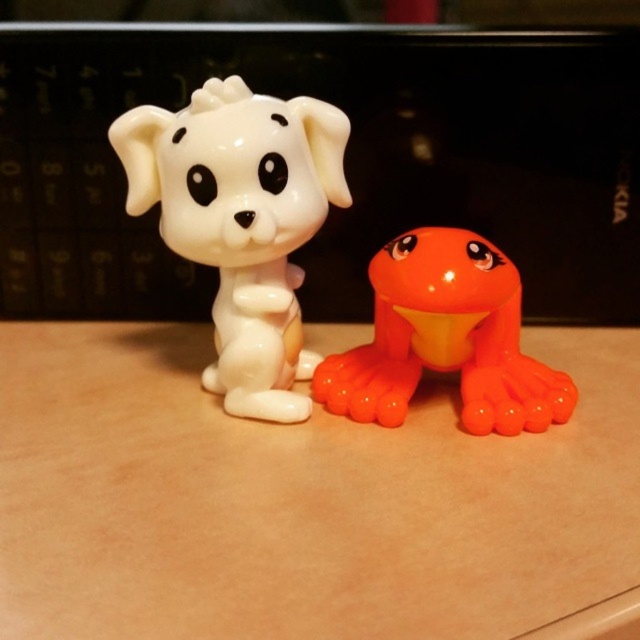
You are a small toy collector standing in front of the wooden surface. You want to pick up the closest figurine to you. Which one should you choose between the white glossy dog at center and the orange glossy frog at center?

The white glossy dog at center is closer to you than the orange glossy frog at center, so you should pick up the white glossy dog at center.

You are trying to place a small toy on the matte plastic table at center. According to the coordinates provided, where exactly should you place the toy?

The matte plastic table at center is located at coordinates point [305,500], so you should place the toy there.